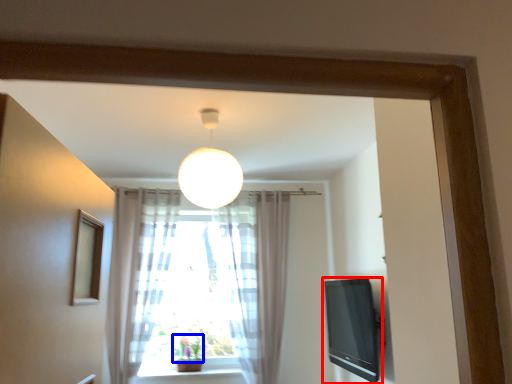
Question: Which object appears closest to the camera in this image, television (highlighted by a red box) or plant (highlighted by a blue box)?

Choices:
 (A) television
 (B) plant

Answer: (A)